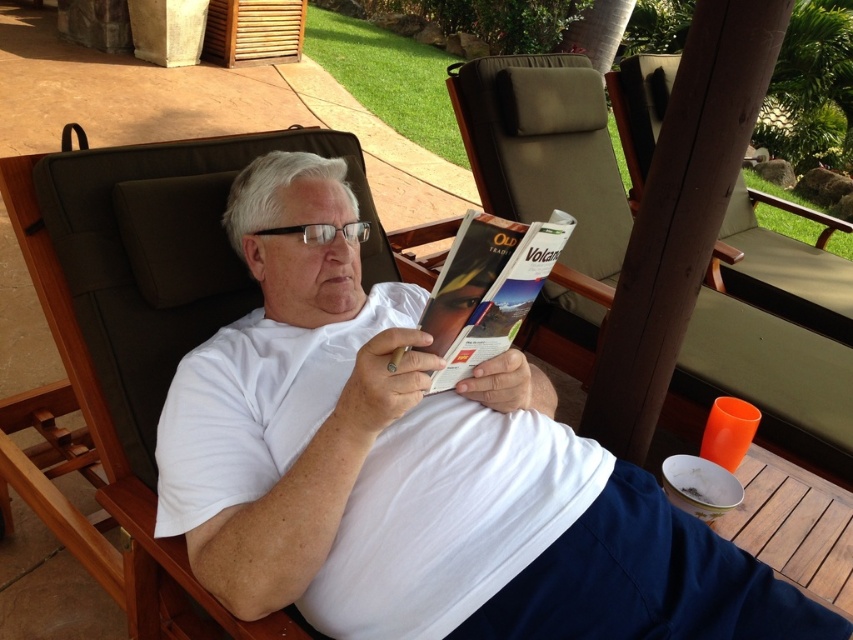
Who is higher up, white matte shirt at center or brown fabric rocking chair at center?

brown fabric rocking chair at center

Is white matte shirt at center below brown fabric rocking chair at center?

Yes, white matte shirt at center is below brown fabric rocking chair at center.

The width and height of the screenshot is (853, 640). Describe the element at coordinates (416, 468) in the screenshot. I see `white matte shirt at center` at that location.

Find the location of a particular element. white matte shirt at center is located at coordinates (416, 468).

Which is below, brown fabric beach chair at center or matte paper magazine at center?

brown fabric beach chair at center

Is point (132, 397) positioned behind point (547, 232)?

Yes.

Image resolution: width=853 pixels, height=640 pixels. I want to click on brown fabric beach chair at center, so click(x=152, y=310).

Consider the image. Does brown fabric rocking chair at center have a smaller size compared to matte paper magazine at center?

No.

Which of these two, brown fabric rocking chair at center or matte paper magazine at center, stands taller?

brown fabric rocking chair at center

The image size is (853, 640). Describe the element at coordinates (544, 150) in the screenshot. I see `brown fabric rocking chair at center` at that location.

At what (x,y) coordinates should I click in order to perform the action: click on brown fabric rocking chair at center. Please return your answer as a coordinate pair (x, y). Looking at the image, I should click on (544, 150).